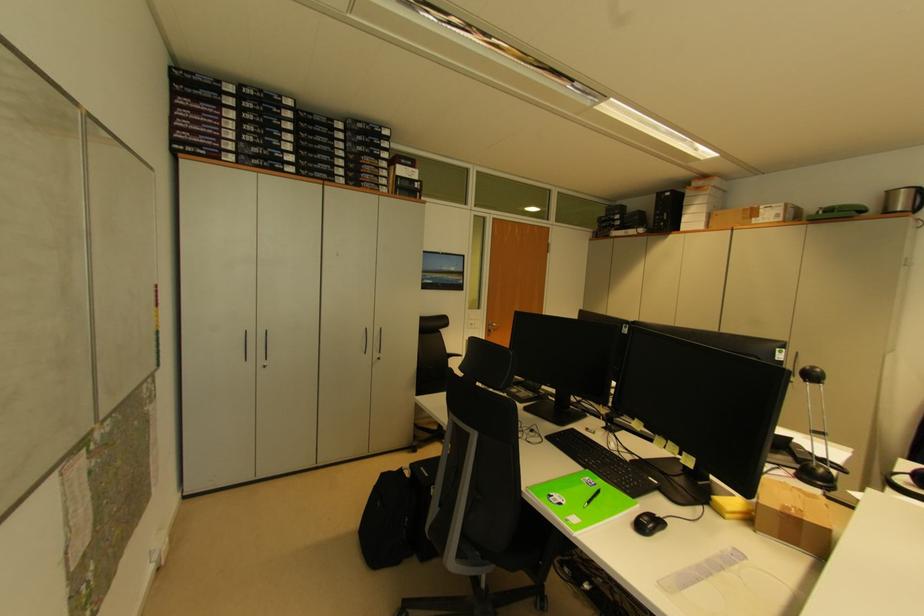
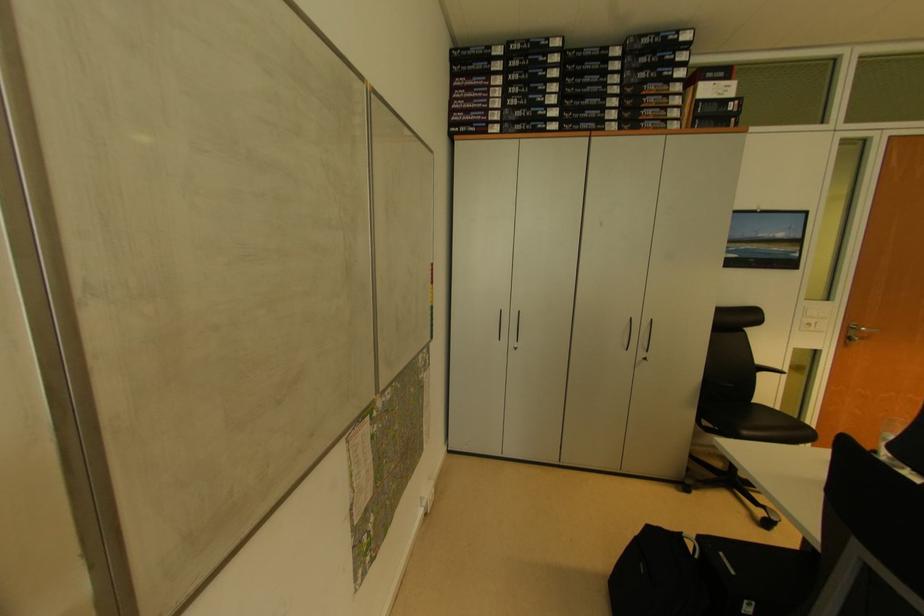
Question: The camera is either moving clockwise (left) or counter-clockwise (right) around the object. The first image is from the beginning of the video and the second image is from the end. Is the camera moving left or right when shooting the video?

Choices:
 (A) Left
 (B) Right

Answer: (B)